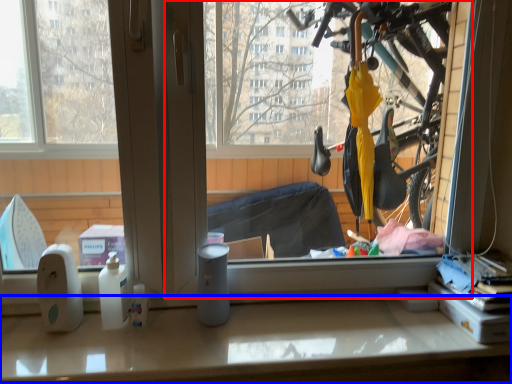
Question: Among these objects, which one is nearest to the camera, window screen (highlighted by a red box) or counter top (highlighted by a blue box)?

Choices:
 (A) window screen
 (B) counter top

Answer: (A)